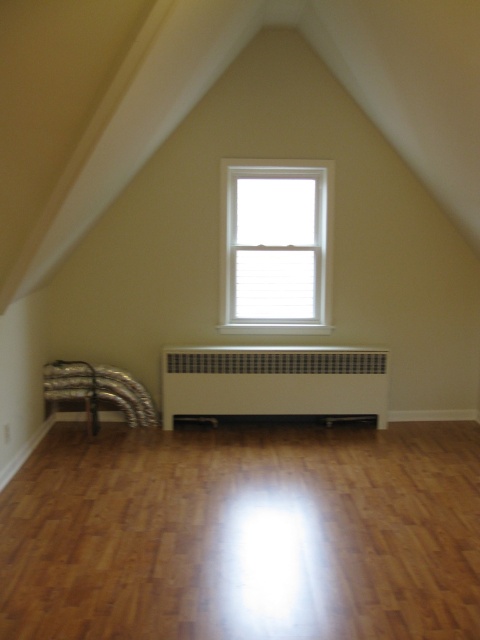
Question: Which object appears closest to the camera in this image?

Choices:
 (A) white matte radiator at center
 (B) white matte window at center

Answer: (A)

Question: Can you confirm if light brown wood floor at center is positioned above white matte radiator at center?

Choices:
 (A) yes
 (B) no

Answer: (B)

Question: Which object is the farthest from the light brown wood floor at center?

Choices:
 (A) silver reflective ducts at lower left
 (B) white matte radiator at center

Answer: (A)

Question: Is light brown wood floor at center above white matte radiator at center?

Choices:
 (A) yes
 (B) no

Answer: (B)

Question: Is light brown wood floor at center closer to the viewer compared to silver reflective ducts at lower left?

Choices:
 (A) yes
 (B) no

Answer: (A)

Question: Which point appears closest to the camera in this image?

Choices:
 (A) (60, 364)
 (B) (282, 310)

Answer: (A)